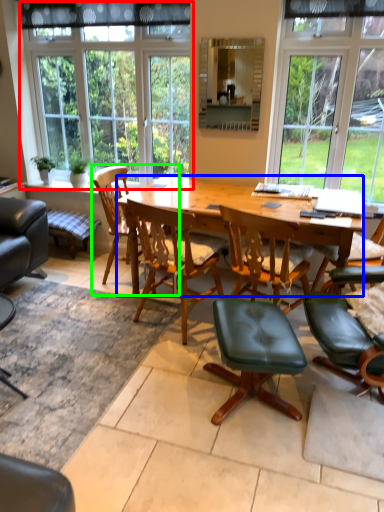
Question: Estimate the real-world distances between objects in this image. Which object is closer to window (highlighted by a red box), desk (highlighted by a blue box) or chair (highlighted by a green box)?

Choices:
 (A) desk
 (B) chair

Answer: (B)